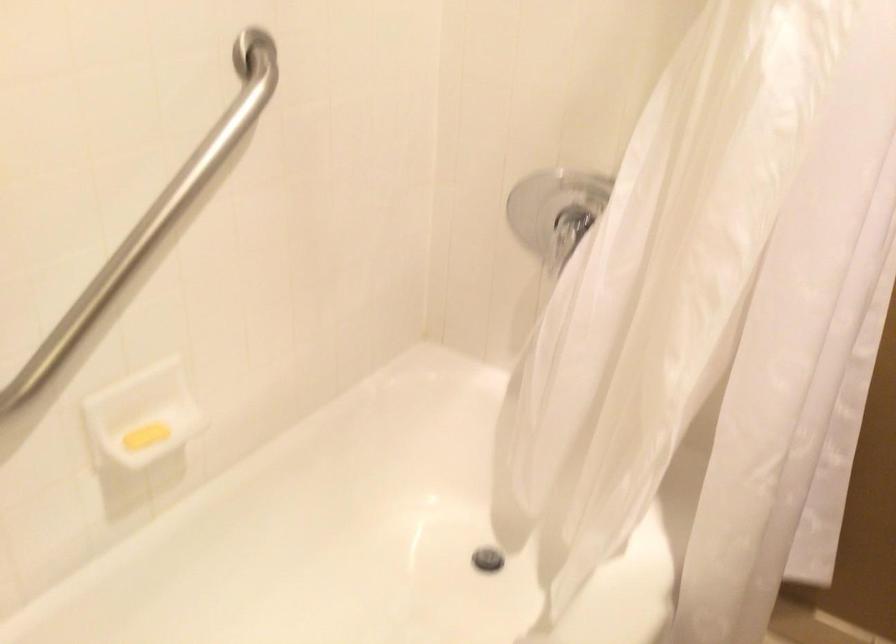
Identify the location of metal grab bar. The image size is (896, 644). (154, 218).